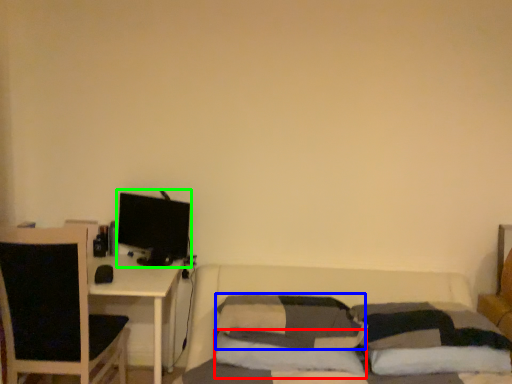
Question: Estimate the real-world distances between objects in this image. Which object is closer to pillow (highlighted by a red box), pillow (highlighted by a blue box) or computer monitor (highlighted by a green box)?

Choices:
 (A) pillow
 (B) computer monitor

Answer: (A)